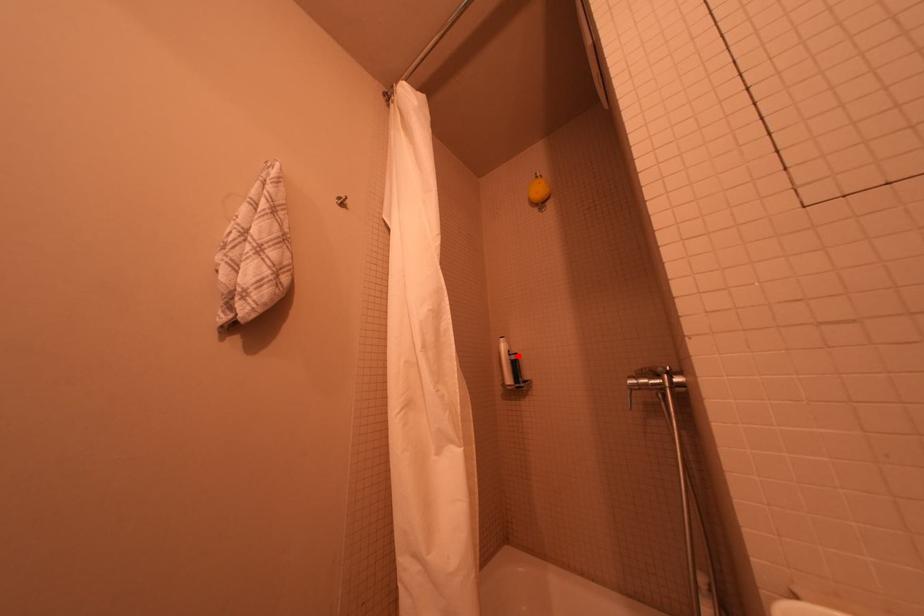
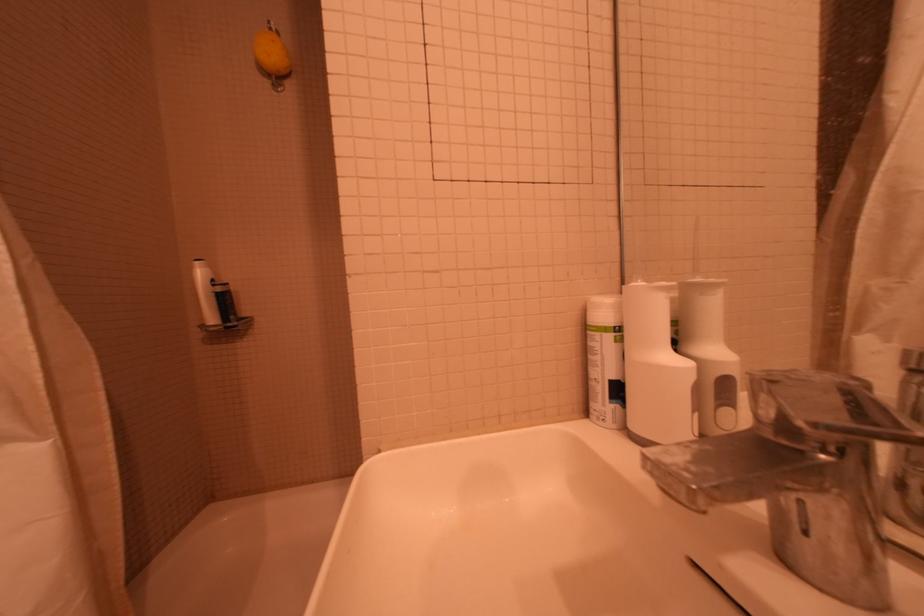
Find the pixel in the second image that matches the highlighted location in the first image.

(223, 286)